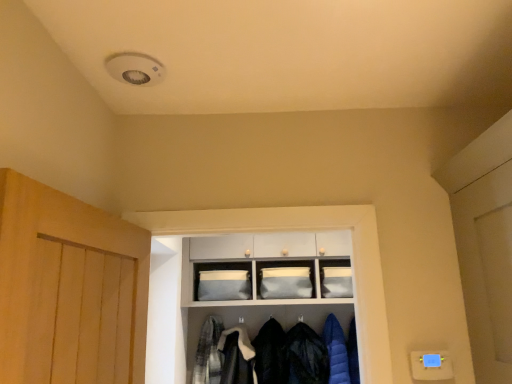
Describe the element at coordinates (336, 278) in the screenshot. Image resolution: width=512 pixels, height=384 pixels. I see `matte gray fabric cabinet at upper center` at that location.

You are a GUI agent. You are given a task and a screenshot of the screen. Output one action in this format:
    pyautogui.click(x=<x>, y=<y>)
    Task: Click on the satin fabric cabinet at center
    The width and height of the screenshot is (512, 384).
    Given the screenshot: What is the action you would take?
    pyautogui.click(x=222, y=281)

What do you see at coordinates (262, 280) in the screenshot? The height and width of the screenshot is (384, 512). I see `gray fabric storage at center, which ranks as the second shelf in top-to-bottom order` at bounding box center [262, 280].

What is the approximate width of plaid fabric shirt at center, which is counted as the 5th clothing, starting from the right?

plaid fabric shirt at center, which is counted as the 5th clothing, starting from the right, is 21.05 centimeters in width.

Image resolution: width=512 pixels, height=384 pixels. Find the location of `blue quilted jacket at lower right, positioned as the 1th clothing in right-to-left order`. blue quilted jacket at lower right, positioned as the 1th clothing in right-to-left order is located at coordinates (336, 351).

Find the location of a particular element. This screenshot has width=512, height=384. velvet black coat at center, which is counted as the third clothing, starting from the left is located at coordinates (271, 354).

How much space does velvet black coat at center, placed as the third clothing when sorted from right to left, occupy horizontally?

velvet black coat at center, placed as the third clothing when sorted from right to left, is 10.35 inches wide.

Image resolution: width=512 pixels, height=384 pixels. Identify the location of white fluffy coat at lower center, which appears as the second clothing when viewed from the left. (237, 356).

I want to click on matte gray fabric cabinet at upper center, so click(x=336, y=278).

Which object is thinner, gray fabric storage at center, the 1th shelf when ordered from bottom to top, or dark blue quilted jacket at center, the second clothing in the right-to-left sequence?

dark blue quilted jacket at center, the second clothing in the right-to-left sequence.

Does gray fabric storage at center, the 1th shelf when ordered from bottom to top, have a smaller size compared to dark blue quilted jacket at center, the 4th clothing positioned from the left?

No.

From a real-world perspective, is gray fabric storage at center, the 1th shelf when ordered from bottom to top, above or below dark blue quilted jacket at center, the second clothing in the right-to-left sequence?

Clearly, from a real-world perspective, gray fabric storage at center, the 1th shelf when ordered from bottom to top, is above dark blue quilted jacket at center, the second clothing in the right-to-left sequence.

From the image's perspective, which is above, gray fabric storage at center, the 1th shelf when ordered from bottom to top, or dark blue quilted jacket at center, the 4th clothing positioned from the left?

gray fabric storage at center, the 1th shelf when ordered from bottom to top, from the image's perspective.

From a real-world perspective, does white fluffy coat at lower center, which is the 4th clothing from right to left, sit lower than plaid fabric shirt at center, which is counted as the 5th clothing, starting from the right?

Yes.

Can you confirm if white fluffy coat at lower center, which appears as the second clothing when viewed from the left, is thinner than plaid fabric shirt at center, the 1th clothing viewed from the left?

In fact, white fluffy coat at lower center, which appears as the second clothing when viewed from the left, might be wider than plaid fabric shirt at center, the 1th clothing viewed from the left.

Is white fluffy coat at lower center, which is the 4th clothing from right to left, oriented towards plaid fabric shirt at center, the 1th clothing viewed from the left?

No.

Between point (227, 343) and point (306, 354), which one is positioned in front?

The point (306, 354) is closer.

Is white fluffy coat at lower center, which is the 4th clothing from right to left, far from dark blue quilted jacket at center, the second clothing in the right-to-left sequence?

white fluffy coat at lower center, which is the 4th clothing from right to left, is actually quite close to dark blue quilted jacket at center, the second clothing in the right-to-left sequence.

From a real-world perspective, does white fluffy coat at lower center, which appears as the second clothing when viewed from the left, sit lower than dark blue quilted jacket at center, the second clothing in the right-to-left sequence?

No, from a real-world perspective, white fluffy coat at lower center, which appears as the second clothing when viewed from the left, is not below dark blue quilted jacket at center, the second clothing in the right-to-left sequence.

I want to click on the 3rd clothing located beneath the blue quilted jacket at lower right, positioned as the 1th clothing in right-to-left order (from a real-world perspective), so 306,356.

From the image's perspective, which one is positioned lower, dark blue quilted jacket at center, the 4th clothing positioned from the left, or blue quilted jacket at lower right, the fifth clothing in the left-to-right sequence?

dark blue quilted jacket at center, the 4th clothing positioned from the left, appears lower in the image.

Which object is further away from the camera taking this photo, dark blue quilted jacket at center, the 4th clothing positioned from the left, or blue quilted jacket at lower right, positioned as the 1th clothing in right-to-left order?

dark blue quilted jacket at center, the 4th clothing positioned from the left.

Considering the relative sizes of dark blue quilted jacket at center, the second clothing in the right-to-left sequence, and blue quilted jacket at lower right, the fifth clothing in the left-to-right sequence, in the image provided, is dark blue quilted jacket at center, the second clothing in the right-to-left sequence, smaller than blue quilted jacket at lower right, the fifth clothing in the left-to-right sequence,?

Incorrect, dark blue quilted jacket at center, the second clothing in the right-to-left sequence, is not smaller in size than blue quilted jacket at lower right, the fifth clothing in the left-to-right sequence.

In the scene shown: Which is closer, (311, 289) or (222, 281)?

Point (311, 289) is farther from the camera than point (222, 281).

Does gray fabric storage at center, which ranks as the second shelf in top-to-bottom order, turn towards satin fabric cabinet at center?

Yes, gray fabric storage at center, which ranks as the second shelf in top-to-bottom order, is facing satin fabric cabinet at center.

From a real-world perspective, is gray fabric storage at center, which ranks as the second shelf in top-to-bottom order, under satin fabric cabinet at center?

Indeed, from a real-world perspective, gray fabric storage at center, which ranks as the second shelf in top-to-bottom order, is positioned beneath satin fabric cabinet at center.

Does point (214, 380) appear closer or farther from the camera than point (261, 340)?

Point (214, 380) is closer to the camera than point (261, 340).

Is velvet black coat at center, which is counted as the third clothing, starting from the left, at the back of plaid fabric shirt at center, the 1th clothing viewed from the left?

plaid fabric shirt at center, the 1th clothing viewed from the left, does not have its back to velvet black coat at center, which is counted as the third clothing, starting from the left.

Where is `the 1st clothing in front of the plaid fabric shirt at center, which is counted as the 5th clothing, starting from the right, starting your count from the anchor`? The width and height of the screenshot is (512, 384). the 1st clothing in front of the plaid fabric shirt at center, which is counted as the 5th clothing, starting from the right, starting your count from the anchor is located at coordinates (271, 354).

From a real-world perspective, is plaid fabric shirt at center, the 1th clothing viewed from the left, beneath velvet black coat at center, placed as the third clothing when sorted from right to left?

No, from a real-world perspective, plaid fabric shirt at center, the 1th clothing viewed from the left, is not beneath velvet black coat at center, placed as the third clothing when sorted from right to left.

From a real-world perspective, relative to matte gray fabric cabinet at upper center, is velvet black coat at center, which is counted as the third clothing, starting from the left, vertically above or below?

From a real-world perspective, velvet black coat at center, which is counted as the third clothing, starting from the left, is physically below matte gray fabric cabinet at upper center.

Considering the sizes of velvet black coat at center, placed as the third clothing when sorted from right to left, and matte gray fabric cabinet at upper center in the image, is velvet black coat at center, placed as the third clothing when sorted from right to left, bigger or smaller than matte gray fabric cabinet at upper center?

In the image, velvet black coat at center, placed as the third clothing when sorted from right to left, appears to be larger than matte gray fabric cabinet at upper center.

What are the coordinates of `cabinet behind the velvet black coat at center, placed as the third clothing when sorted from right to left` in the screenshot? It's located at (336, 278).

How many degrees apart are the facing directions of velvet black coat at center, which is counted as the third clothing, starting from the left, and matte gray fabric cabinet at upper center?

0.765 degrees separate the facing orientations of velvet black coat at center, which is counted as the third clothing, starting from the left, and matte gray fabric cabinet at upper center.

Which clothing is the 3rd one when counting from the back of the gray fabric storage at center, the 1th shelf when ordered from bottom to top? Please provide its 2D coordinates.

[(306, 356)]

I want to click on the 2nd clothing positioned above the white fluffy coat at lower center, which is the 4th clothing from right to left (from a real-world perspective), so click(209, 353).

Which object lies further to the anchor point satin fabric cabinet at center, satin silver fabric at center, positioned as the 2th shelf in bottom-to-top order, or matte gray fabric cabinet at upper center?

matte gray fabric cabinet at upper center.

When comparing their distances from white fluffy coat at lower center, which is the 4th clothing from right to left, does velvet black coat at center, which is counted as the third clothing, starting from the left, or satin silver fabric at center, arranged as the first shelf when viewed from the top, seem further?

satin silver fabric at center, arranged as the first shelf when viewed from the top.

Based on their spatial positions, is dark blue quilted jacket at center, the second clothing in the right-to-left sequence, or white fluffy coat at lower center, which appears as the second clothing when viewed from the left, further from satin silver fabric at center, arranged as the first shelf when viewed from the top?

The object further to satin silver fabric at center, arranged as the first shelf when viewed from the top, is white fluffy coat at lower center, which appears as the second clothing when viewed from the left.

Based on the photo, which object lies further to the anchor point gray fabric storage at center, which ranks as the second shelf in top-to-bottom order, plaid fabric shirt at center, the 1th clothing viewed from the left, or dark blue quilted jacket at center, the 4th clothing positioned from the left?

Based on the image, plaid fabric shirt at center, the 1th clothing viewed from the left, appears to be further to gray fabric storage at center, which ranks as the second shelf in top-to-bottom order.

Estimate the real-world distances between objects in this image. Which object is further from plaid fabric shirt at center, which is counted as the 5th clothing, starting from the right, velvet black coat at center, which is counted as the third clothing, starting from the left, or satin silver fabric at center, arranged as the first shelf when viewed from the top?

satin silver fabric at center, arranged as the first shelf when viewed from the top, is positioned further to the anchor plaid fabric shirt at center, which is counted as the 5th clothing, starting from the right.

When comparing their distances from velvet black coat at center, placed as the third clothing when sorted from right to left, does satin silver fabric at center, arranged as the first shelf when viewed from the top, or dark blue quilted jacket at center, the second clothing in the right-to-left sequence, seem further?

Based on the image, satin silver fabric at center, arranged as the first shelf when viewed from the top, appears to be further to velvet black coat at center, placed as the third clothing when sorted from right to left.

Estimate the real-world distances between objects in this image. Which object is further from plaid fabric shirt at center, the 1th clothing viewed from the left, dark blue quilted jacket at center, the second clothing in the right-to-left sequence, or blue quilted jacket at lower right, positioned as the 1th clothing in right-to-left order?

The object further to plaid fabric shirt at center, the 1th clothing viewed from the left, is blue quilted jacket at lower right, positioned as the 1th clothing in right-to-left order.

Estimate the real-world distances between objects in this image. Which object is closer to satin silver fabric at center, arranged as the first shelf when viewed from the top, dark blue quilted jacket at center, the 4th clothing positioned from the left, or satin fabric cabinet at center?

satin fabric cabinet at center lies closer to satin silver fabric at center, arranged as the first shelf when viewed from the top, than the other object.

The width and height of the screenshot is (512, 384). I want to click on clothing between white fluffy coat at lower center, which appears as the second clothing when viewed from the left, and dark blue quilted jacket at center, the second clothing in the right-to-left sequence, so click(271, 354).

Where is `shelf that lies between satin silver fabric at center, positioned as the 2th shelf in bottom-to-top order, and velvet black coat at center, which is counted as the third clothing, starting from the left, from top to bottom`? The width and height of the screenshot is (512, 384). shelf that lies between satin silver fabric at center, positioned as the 2th shelf in bottom-to-top order, and velvet black coat at center, which is counted as the third clothing, starting from the left, from top to bottom is located at coordinates (262, 280).

Identify the location of shelf between satin fabric cabinet at center and velvet black coat at center, placed as the third clothing when sorted from right to left, vertically. point(262,280).

Locate an element on the screen. This screenshot has height=384, width=512. shelf between plaid fabric shirt at center, the 1th clothing viewed from the left, and satin silver fabric at center, arranged as the first shelf when viewed from the top, in the horizontal direction is located at coordinates (262, 280).